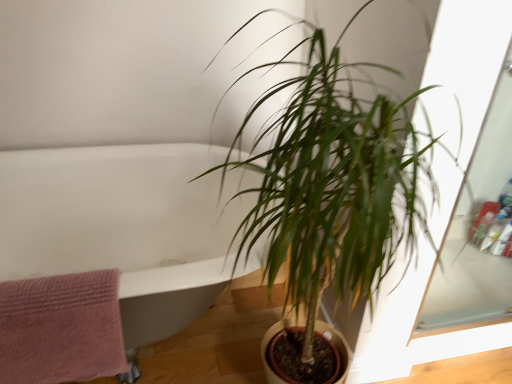
Question: Is point (75, 246) closer or farther from the camera than point (349, 173)?

Choices:
 (A) farther
 (B) closer

Answer: (A)

Question: Is white glossy bathtub at upper left taller or shorter than green leafy plant at center?

Choices:
 (A) tall
 (B) short

Answer: (B)

Question: Which is farther from the green leafy plant at center?

Choices:
 (A) white glossy bathtub at upper left
 (B) pink textured towel at left

Answer: (B)

Question: Which is farther from the green leafy plant at center?

Choices:
 (A) white glossy bathtub at upper left
 (B) pink textured towel at left

Answer: (B)